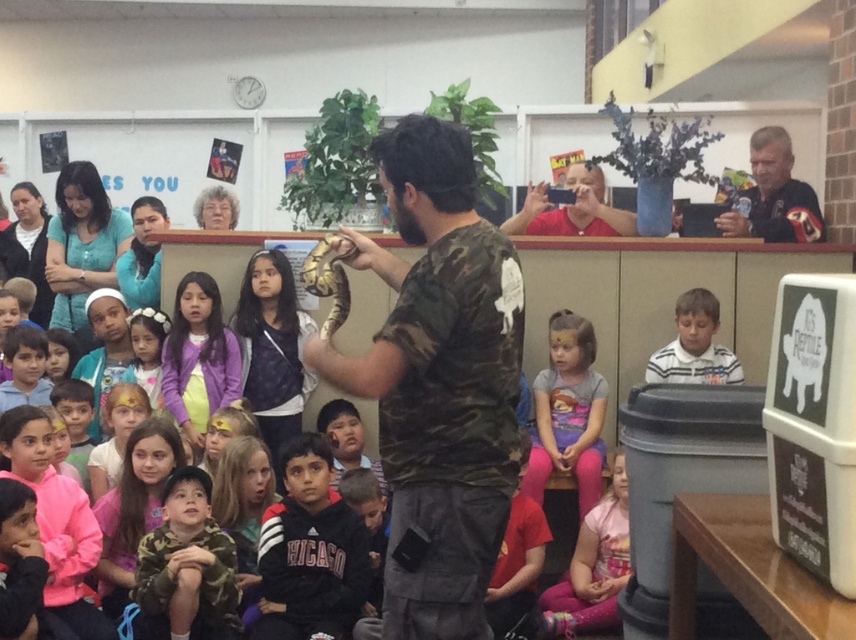
Question: Can you confirm if camo fabric shirt at lower left is thinner than matte gray shirt at center?

Choices:
 (A) no
 (B) yes

Answer: (B)

Question: Which object appears closest to the camera in this image?

Choices:
 (A) white striped shirt at center
 (B) pink leggings at lower center

Answer: (B)

Question: Which object appears farthest from the camera in this image?

Choices:
 (A) pink leggings at lower center
 (B) camouflage fabric shirt at center
 (C) matte gray shirt at center
 (D) dark gray leather jacket at upper right

Answer: (D)

Question: Can you confirm if camouflage fabric shirt at center is bigger than dark gray leather jacket at upper right?

Choices:
 (A) no
 (B) yes

Answer: (B)

Question: Based on their relative distances, which object is nearer to the camo fabric shirt at lower left?

Choices:
 (A) pink leggings at lower center
 (B) matte gray shirt at center
 (C) white striped shirt at center
 (D) camouflage fabric shirt at center

Answer: (A)

Question: Is camouflage fabric shirt at center positioned in front of camo fabric shirt at lower left?

Choices:
 (A) yes
 (B) no

Answer: (A)